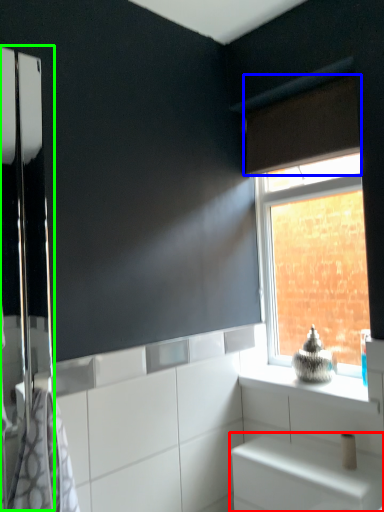
Question: Which object is the farthest from cabinetry (highlighted by a red box)? Choose among these: curtain (highlighted by a blue box) or screen door (highlighted by a green box).

Choices:
 (A) curtain
 (B) screen door

Answer: (A)